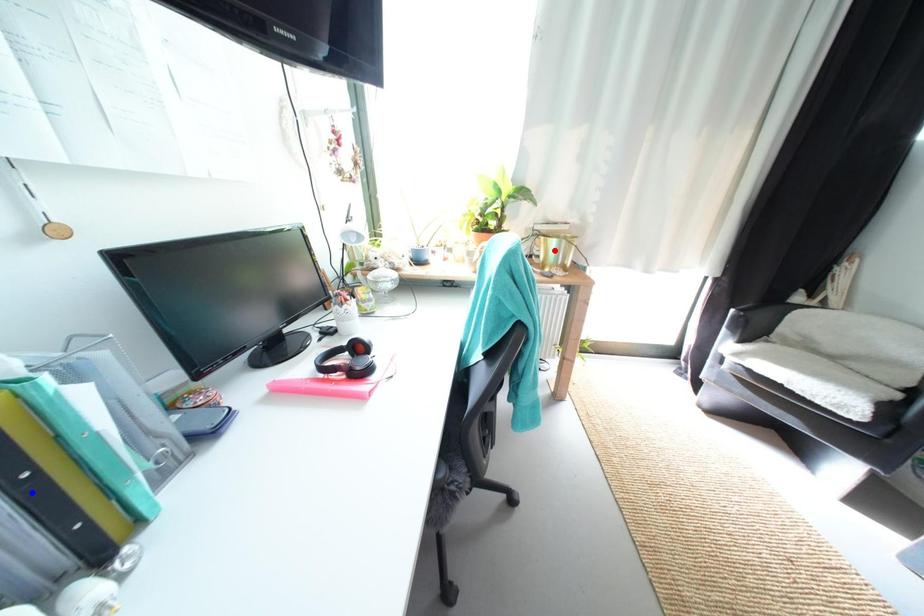
Question: In the image, two points are highlighted. Which point is nearer to the camera? Reply with the corresponding letter.

Choices:
 (A) blue point
 (B) red point

Answer: (A)